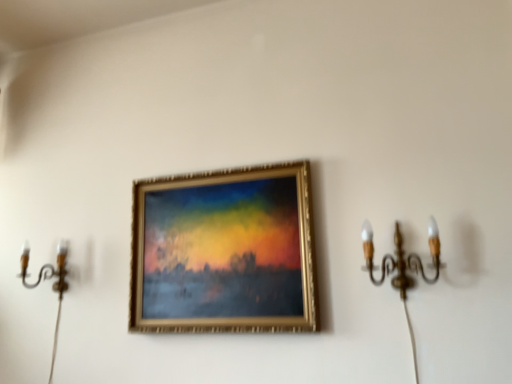
Question: Considering the relative sizes of gold metallic picture frame at center and gold metallic chandelier at right, which appears as the 1th candle holder when viewed from the right, in the image provided, is gold metallic picture frame at center bigger than gold metallic chandelier at right, which appears as the 1th candle holder when viewed from the right,?

Choices:
 (A) no
 (B) yes

Answer: (B)

Question: Does gold metallic picture frame at center have a lesser width compared to gold metallic chandelier at right, the second candle holder positioned from the back?

Choices:
 (A) yes
 (B) no

Answer: (A)

Question: Can we say gold metallic picture frame at center lies outside gold metallic chandelier at right, which appears as the 1th candle holder when viewed from the right?

Choices:
 (A) yes
 (B) no

Answer: (A)

Question: Is gold metallic picture frame at center beside gold metallic chandelier at right, the second candle holder positioned from the back?

Choices:
 (A) no
 (B) yes

Answer: (A)

Question: Does gold metallic picture frame at center contain gold metallic chandelier at right, which is the first candle holder from front to back?

Choices:
 (A) no
 (B) yes

Answer: (A)

Question: Can you confirm if gold metallic picture frame at center is positioned to the left of gold metallic chandelier at right, which appears as the 1th candle holder when viewed from the right?

Choices:
 (A) yes
 (B) no

Answer: (A)

Question: Is gold metallic picture frame at center not near gold metallic candle holder at left, acting as the first candle holder starting from the back?

Choices:
 (A) yes
 (B) no

Answer: (B)

Question: Does gold metallic picture frame at center lie in front of gold metallic candle holder at left, the 1th candle holder viewed from the left?

Choices:
 (A) no
 (B) yes

Answer: (B)

Question: Can you confirm if gold metallic picture frame at center is taller than gold metallic candle holder at left, the 1th candle holder viewed from the left?

Choices:
 (A) no
 (B) yes

Answer: (B)

Question: Considering the relative sizes of gold metallic picture frame at center and gold metallic candle holder at left, positioned as the 2th candle holder in front-to-back order, in the image provided, is gold metallic picture frame at center smaller than gold metallic candle holder at left, positioned as the 2th candle holder in front-to-back order,?

Choices:
 (A) no
 (B) yes

Answer: (A)

Question: Does gold metallic picture frame at center touch gold metallic candle holder at left, placed as the 2th candle holder when sorted from right to left?

Choices:
 (A) yes
 (B) no

Answer: (B)

Question: From the image's perspective, does gold metallic picture frame at center appear higher than gold metallic candle holder at left, acting as the first candle holder starting from the back?

Choices:
 (A) yes
 (B) no

Answer: (A)

Question: Is gold metallic chandelier at right, which is the first candle holder from front to back, in front of gold metallic picture frame at center?

Choices:
 (A) no
 (B) yes

Answer: (B)